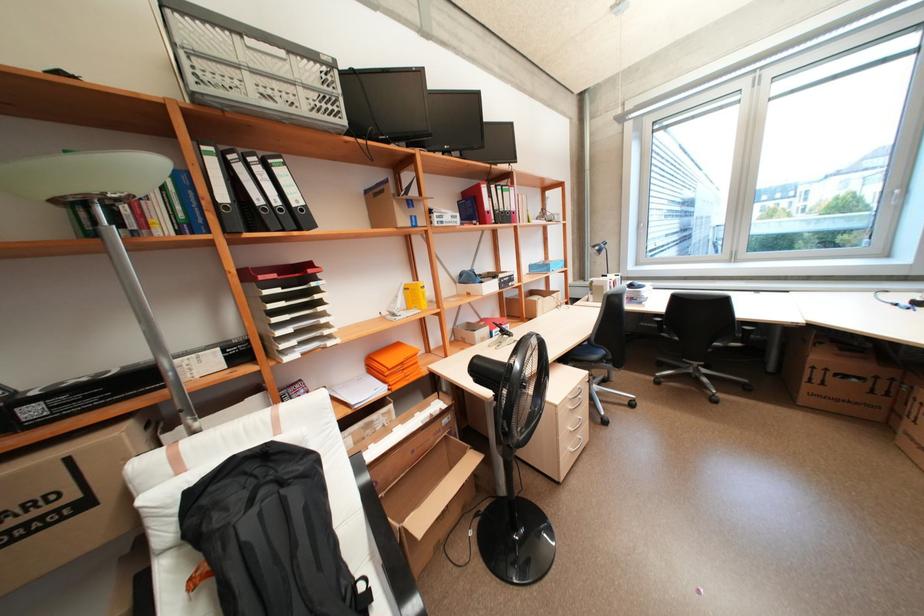
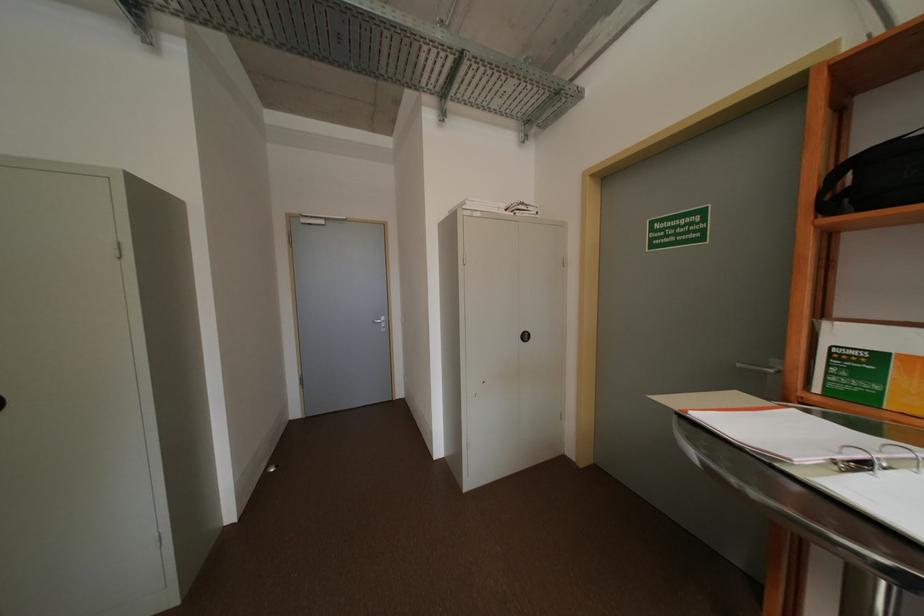
How did the camera likely rotate?

The camera rotated toward left-down.